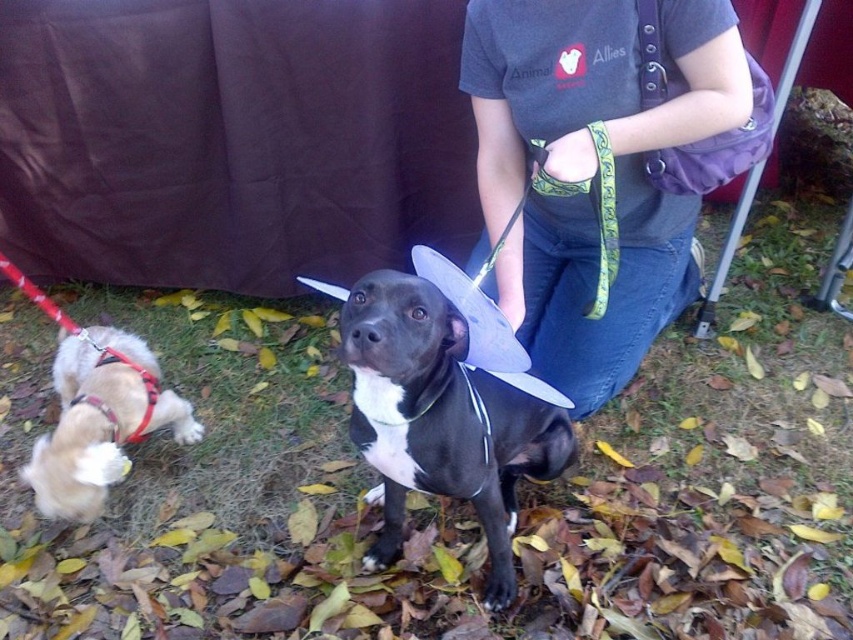
Based on the scene description, where is the black matte dog at center in relation to the red nylon leash at lower left?

The black matte dog at center is to the right of the red nylon leash at lower left.

You are standing at the point with coordinates point (140,432) and want to walk towards the dog wearing a red harness and leash. Which direction should you move relative to the point (398,529)?

To reach the dog wearing a red harness and leash, you should move towards point (140,432), which is behind point (398,529) according to their spatial relationship.